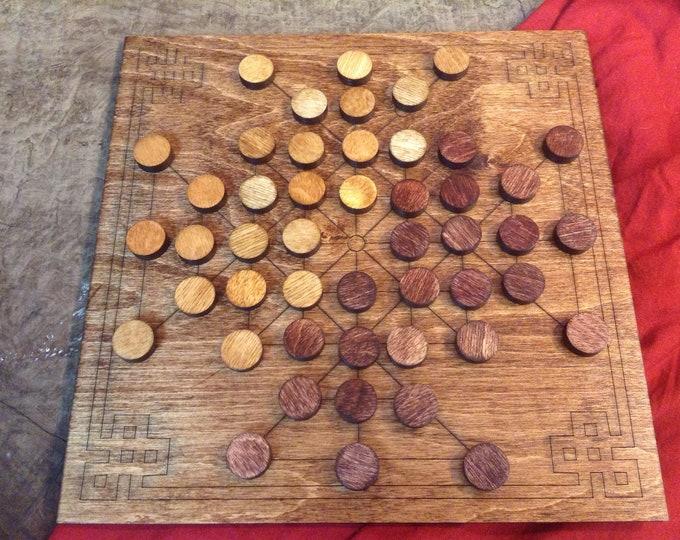
Locate an element on the screen. The image size is (680, 540). board is located at coordinates (197, 110).